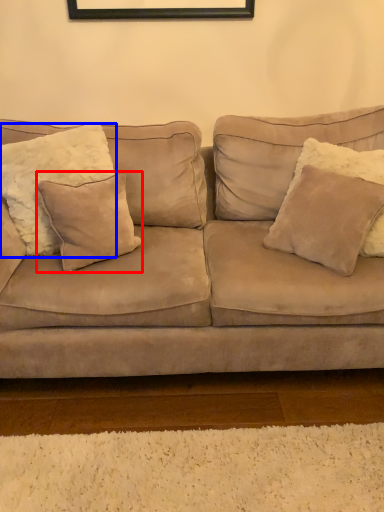
Question: Which object is closer to the camera taking this photo, pillow (highlighted by a red box) or pillow (highlighted by a blue box)?

Choices:
 (A) pillow
 (B) pillow

Answer: (B)